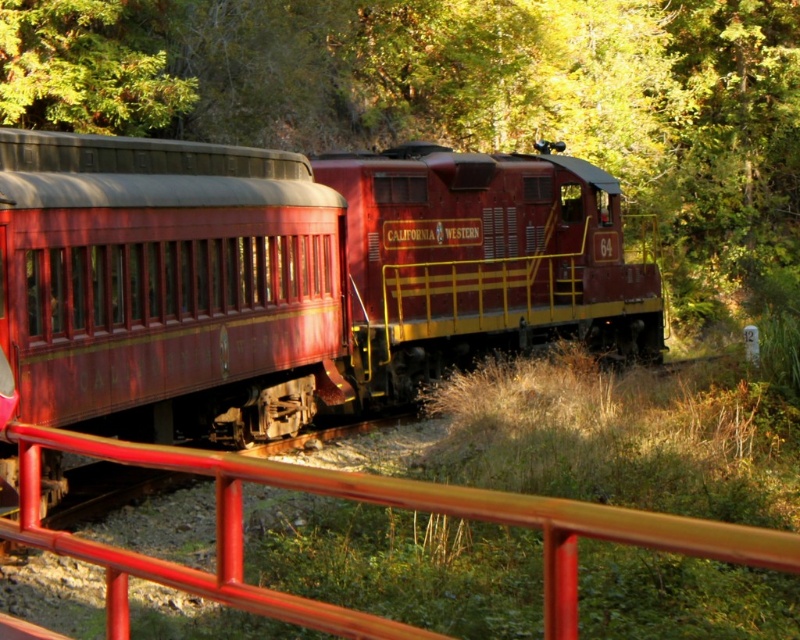
Question: Does metallic red train at center appear under green leafy tree at upper left?

Choices:
 (A) no
 (B) yes

Answer: (B)

Question: In this image, where is metallic red train at center located relative to green leafy tree at upper left?

Choices:
 (A) right
 (B) left

Answer: (A)

Question: Is metallic red train at center to the right of green leafy tree at upper left from the viewer's perspective?

Choices:
 (A) yes
 (B) no

Answer: (A)

Question: Which object is positioned closest to the metallic red rail at center?

Choices:
 (A) green leafy tree at upper left
 (B) metallic red train at center

Answer: (B)

Question: Estimate the real-world distances between objects in this image. Which object is closer to the green leafy tree at upper left?

Choices:
 (A) metallic red train at center
 (B) metallic red rail at center

Answer: (A)

Question: Which point is closer to the camera?

Choices:
 (A) (448, 276)
 (B) (84, 77)
 (C) (48, 429)

Answer: (C)